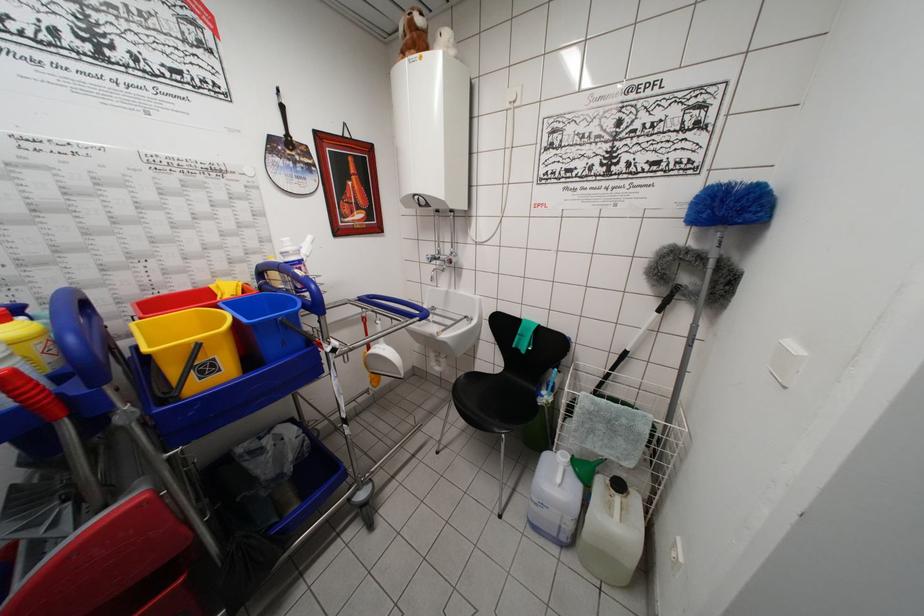
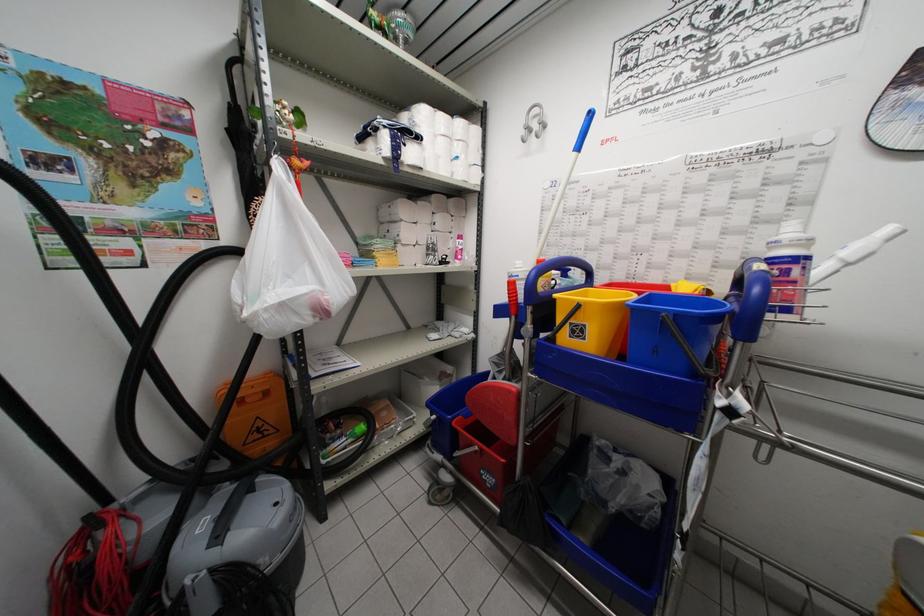
Question: Based on the continuous images, in which direction is the camera rotating? Reply with the corresponding letter.

Choices:
 (A) Left
 (B) Right
 (C) Up
 (D) Down

Answer: (A)